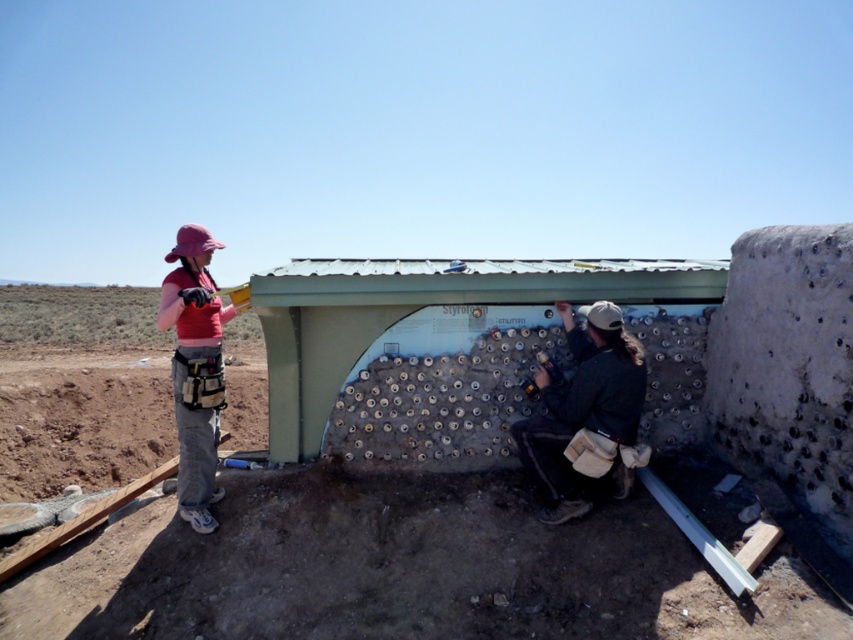
Can you confirm if textured concrete wall at center is positioned below dark green jacket at center?

Yes, textured concrete wall at center is below dark green jacket at center.

Who is taller, textured concrete wall at center or dark green jacket at center?

With more height is textured concrete wall at center.

What do you see at coordinates (397, 520) in the screenshot? This screenshot has width=853, height=640. I see `textured concrete wall at center` at bounding box center [397, 520].

You are a GUI agent. You are given a task and a screenshot of the screen. Output one action in this format:
    pyautogui.click(x=<x>, y=<y>)
    Task: Click on the textured concrete wall at center
    The width and height of the screenshot is (853, 640).
    Given the screenshot: What is the action you would take?
    pyautogui.click(x=397, y=520)

Is point (619, 428) closer to camera compared to point (216, 374)?

Yes, it is in front of point (216, 374).

Is dark green jacket at center thinner than pink fabric construction worker at left?

No, dark green jacket at center is not thinner than pink fabric construction worker at left.

Is point (563, 436) positioned before point (186, 225)?

That is True.

At what (x,y) coordinates should I click in order to perform the action: click on dark green jacket at center. Please return your answer as a coordinate pair (x, y). This screenshot has width=853, height=640. Looking at the image, I should click on (585, 413).

Does textured concrete wall at center have a larger size compared to pink fabric construction worker at left?

Yes, textured concrete wall at center is bigger than pink fabric construction worker at left.

Does point (416, 493) come closer to viewer compared to point (192, 484)?

That is False.

Does point (531, 573) come farther from viewer compared to point (204, 323)?

No, (531, 573) is closer to viewer.

Find the location of `textured concrete wall at center`. textured concrete wall at center is located at coordinates (397, 520).